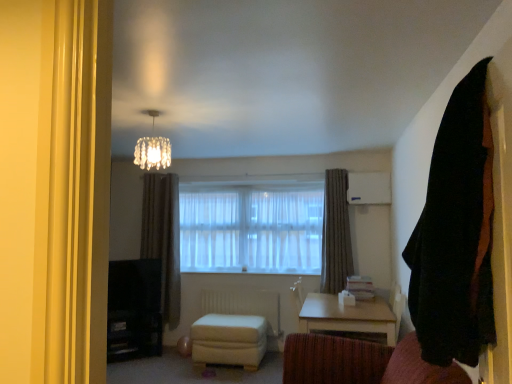
The height and width of the screenshot is (384, 512). Describe the element at coordinates (348, 317) in the screenshot. I see `light wood/texture table at lower center` at that location.

Locate an element on the screen. white leather stool at center is located at coordinates (229, 340).

The height and width of the screenshot is (384, 512). I want to click on gray textured curtain at center, positioned as the 2th curtain in back-to-front order, so click(x=336, y=233).

Measure the distance between white plastic radiator at lower center and camera.

5.18 meters.

Find the location of a particular element. light wood/texture table at lower center is located at coordinates (348, 317).

Considering the positions of points (461, 177) and (154, 122), is point (461, 177) closer to camera compared to point (154, 122)?

Yes, it is.

Which is in front, black fabric curtain at right, positioned as the third curtain in back-to-front order, or crystal glass chandelier at upper center?

black fabric curtain at right, positioned as the third curtain in back-to-front order, is in front.

What's the angular difference between black fabric curtain at right, placed as the first curtain when sorted from front to back, and crystal glass chandelier at upper center's facing directions?

The angular difference between black fabric curtain at right, placed as the first curtain when sorted from front to back, and crystal glass chandelier at upper center is 104 degrees.

Is gray textured curtain at center, which is the 1th curtain in right-to-left order, at the back of black fabric curtain at right, the second curtain when ordered from left to right?

No, black fabric curtain at right, the second curtain when ordered from left to right, is not facing away from gray textured curtain at center, which is the 1th curtain in right-to-left order.

There is a black fabric curtain at right, positioned as the third curtain in back-to-front order. At what (x,y) coordinates should I click in order to perform the action: click on the 1st curtain below it (from the image's perspective). Please return your answer as a coordinate pair (x, y). Looking at the image, I should click on (336, 233).

From a real-world perspective, is black fabric curtain at right, the second curtain viewed from the right, on top of gray textured curtain at center, positioned as the 2th curtain in back-to-front order?

Yes, from a real-world perspective, black fabric curtain at right, the second curtain viewed from the right, is on top of gray textured curtain at center, positioned as the 2th curtain in back-to-front order.

Is black fabric curtain at right, the second curtain viewed from the right, situated inside gray textured curtain at center, which is the 1th curtain in right-to-left order, or outside?

black fabric curtain at right, the second curtain viewed from the right, cannot be found inside gray textured curtain at center, which is the 1th curtain in right-to-left order.

From the image's perspective, is white plastic radiator at lower center above or below black fabric curtain at right, placed as the first curtain when sorted from front to back?

white plastic radiator at lower center is situated lower than black fabric curtain at right, placed as the first curtain when sorted from front to back, in the image.

How much distance is there between white plastic radiator at lower center and black fabric curtain at right, positioned as the third curtain in back-to-front order?

They are 13.81 feet apart.

Considering the positions of point (272, 332) and point (440, 192), is point (272, 332) closer or farther from the camera than point (440, 192)?

Clearly, point (272, 332) is more distant from the camera than point (440, 192).

Considering the positions of objects white plastic radiator at lower center and black fabric curtain at right, placed as the first curtain when sorted from front to back, in the image provided, who is more to the left, white plastic radiator at lower center or black fabric curtain at right, placed as the first curtain when sorted from front to back,?

From the viewer's perspective, white plastic radiator at lower center appears more on the left side.

Find the location of a particular element. lamp above the gray textured curtain at center, positioned as the 2th curtain in back-to-front order (from the image's perspective) is located at coordinates (152, 148).

Which of these two, gray textured curtain at center, which is the 1th curtain in right-to-left order, or crystal glass chandelier at upper center, stands taller?

Standing taller between the two is gray textured curtain at center, which is the 1th curtain in right-to-left order.

Which is in front, gray textured curtain at center, which is the 1th curtain in right-to-left order, or crystal glass chandelier at upper center?

crystal glass chandelier at upper center is closer to the camera.

Which is more to the right, gray textured curtain at center, placed as the 3th curtain when sorted from left to right, or crystal glass chandelier at upper center?

From the viewer's perspective, gray textured curtain at center, placed as the 3th curtain when sorted from left to right, appears more on the right side.

How different are the orientations of white leather stool at center and gray textured curtain at center, which is the 1th curtain in right-to-left order, in degrees?

The facing directions of white leather stool at center and gray textured curtain at center, which is the 1th curtain in right-to-left order, are 0.836 degrees apart.

Does point (261, 318) come behind point (340, 281)?

Yes, it is.

Where is `stool located on the left of gray textured curtain at center, which is the 1th curtain in right-to-left order`? This screenshot has width=512, height=384. stool located on the left of gray textured curtain at center, which is the 1th curtain in right-to-left order is located at coordinates (229, 340).

Can you confirm if white leather stool at center is taller than light wood/texture table at lower center?

Incorrect, the height of white leather stool at center is not larger of that of light wood/texture table at lower center.

Considering the relative sizes of white leather stool at center and light wood/texture table at lower center in the image provided, is white leather stool at center wider than light wood/texture table at lower center?

No, white leather stool at center is not wider than light wood/texture table at lower center.

In the scene shown: Is white leather stool at center facing away from light wood/texture table at lower center?

That's not correct — white leather stool at center is not looking away from light wood/texture table at lower center.

Is light wood/texture table at lower center looking in the opposite direction of white sheer curtains at center?

No.

Which is in front, light wood/texture table at lower center or white sheer curtains at center?

light wood/texture table at lower center is more forward.

Which of these two, light wood/texture table at lower center or white sheer curtains at center, is thinner?

With smaller width is white sheer curtains at center.

Is light wood/texture table at lower center far away from white sheer curtains at center?

That's right, there is a large distance between light wood/texture table at lower center and white sheer curtains at center.

The image size is (512, 384). I want to click on the 1st curtain directly beneath the crystal glass chandelier at upper center (from a real-world perspective), so click(x=456, y=233).

This screenshot has width=512, height=384. Find the location of `curtain on the right of black fabric curtain at right, the second curtain when ordered from left to right`. curtain on the right of black fabric curtain at right, the second curtain when ordered from left to right is located at coordinates (336, 233).

Looking at the image, which one is located further to black fabric curtain at right, the second curtain viewed from the right, crystal glass chandelier at upper center or light wood/texture table at lower center?

crystal glass chandelier at upper center lies further to black fabric curtain at right, the second curtain viewed from the right, than the other object.

Which object lies further to the anchor point gray textured curtain at center, the second curtain in the front-to-back sequence, white sheer curtains at center or white leather stool at center?

Based on the image, white leather stool at center appears to be further to gray textured curtain at center, the second curtain in the front-to-back sequence.

When comparing their distances from crystal glass chandelier at upper center, does gray textured curtain at center, placed as the 3th curtain when sorted from left to right, or white leather stool at center seem further?

Based on the image, gray textured curtain at center, placed as the 3th curtain when sorted from left to right, appears to be further to crystal glass chandelier at upper center.

Based on their spatial positions, is white plastic radiator at lower center or gray textured curtain at center, which is the 1th curtain in right-to-left order, closer to light wood/texture table at lower center?

gray textured curtain at center, which is the 1th curtain in right-to-left order.

When comparing their distances from crystal glass chandelier at upper center, does dark gray textured curtain at left, which is the 1th curtain from left to right, or light wood/texture table at lower center seem closer?

dark gray textured curtain at left, which is the 1th curtain from left to right, lies closer to crystal glass chandelier at upper center than the other object.

When comparing their distances from dark gray textured curtain at left, placed as the first curtain when sorted from back to front, does crystal glass chandelier at upper center or white sheer curtains at center seem closer?

white sheer curtains at center is positioned closer to the anchor dark gray textured curtain at left, placed as the first curtain when sorted from back to front.

From the image, which object appears to be farther from black fabric curtain at right, positioned as the third curtain in back-to-front order, gray textured curtain at center, which is the 1th curtain in right-to-left order, or white plastic radiator at lower center?

white plastic radiator at lower center.

Looking at the image, which one is located further to dark gray textured curtain at left, placed as the first curtain when sorted from back to front, light wood/texture table at lower center or crystal glass chandelier at upper center?

Based on the image, light wood/texture table at lower center appears to be further to dark gray textured curtain at left, placed as the first curtain when sorted from back to front.

Find the location of a particular element. The height and width of the screenshot is (384, 512). table between black fabric curtain at right, positioned as the third curtain in back-to-front order, and white sheer curtains at center, along the z-axis is located at coordinates (348, 317).

Identify the location of stool between dark gray textured curtain at left, the 3th curtain in the front-to-back sequence, and gray textured curtain at center, which is the 1th curtain in right-to-left order, in the horizontal direction. (229, 340).

Find the location of a particular element. The image size is (512, 384). window between dark gray textured curtain at left, placed as the first curtain when sorted from back to front, and light wood/texture table at lower center, in the horizontal direction is located at coordinates (252, 225).

Where is `curtain positioned between light wood/texture table at lower center and white plastic radiator at lower center from near to far`? The width and height of the screenshot is (512, 384). curtain positioned between light wood/texture table at lower center and white plastic radiator at lower center from near to far is located at coordinates (336, 233).